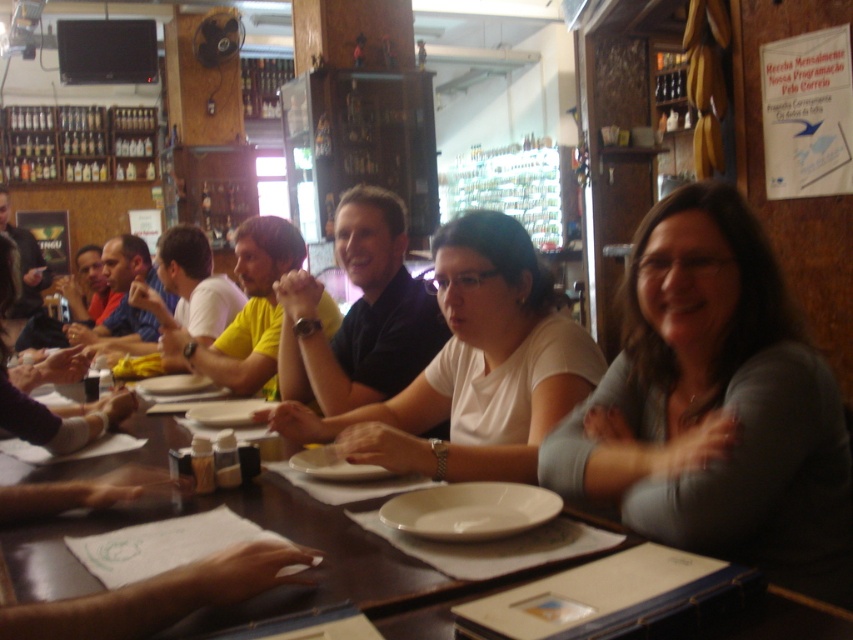
You are a waiter in a restaurant. You need to place a 30 cm long plate on the wooden table at center without it touching the white matte shirt at center. Is this possible?

The white matte shirt at center is 38.03 centimeters away from the wooden table at center. Since the plate is only 30 cm long, placing it on the table without touching the shirt is possible as the distance between them is greater than the plate length.

Based on the photo, you are a food delivery person standing at the entrance of the restaurant. You need to place a delivered meal on the table near the gray matte shirt at center. The delivery cart you are using is 1.2 meters wide. Can you maneuver the cart to the table without moving any chairs?

The distance between the gray matte shirt at center and the camera is 1.11 meters. Since the delivery cart is 1.2 meters wide, which is wider than the available space, you cannot maneuver the cart to the table without moving some chairs.

You are standing at the entrance of the restaurant and see two points marked on the floor. The first point is labeled as point (801, 449) and the second is point (142, 504). If you want to walk from the entrance to the point that is closer to the table where the group is seated, which point should you head towards?

Point (801, 449) is in front of point (142, 504), so the point closer to the table where the group is seated is point (801, 449).